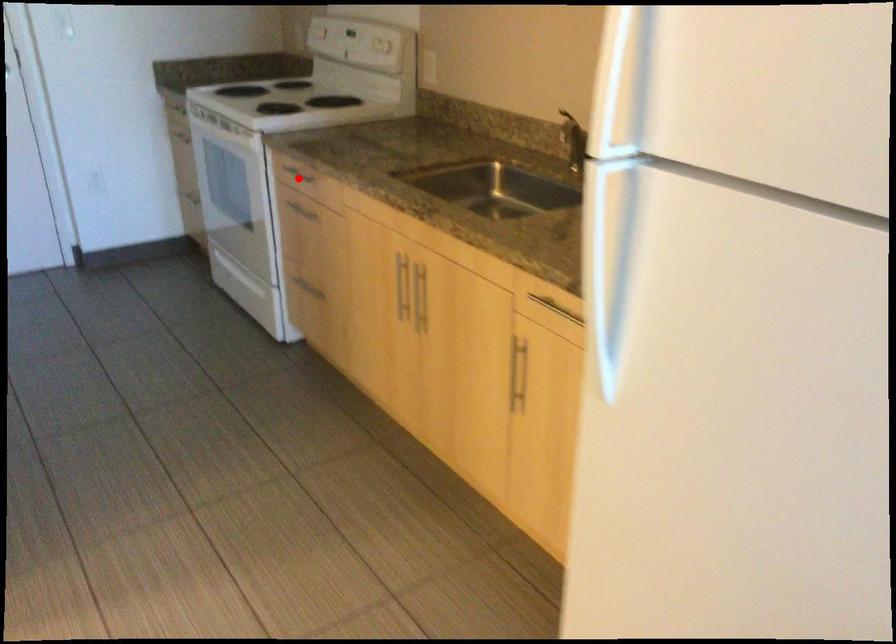
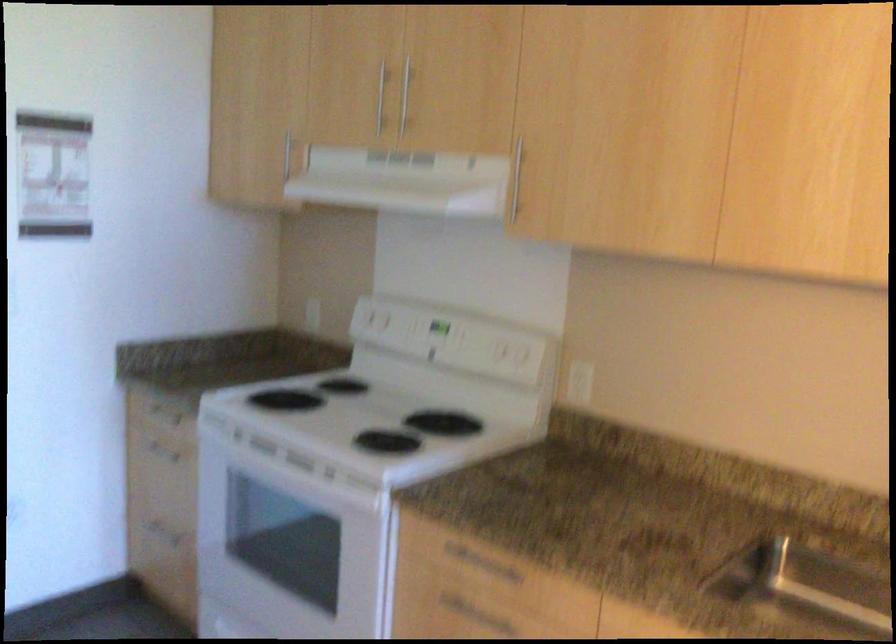
Question: A red point is marked in image1. In image2, is the corresponding 3D point closer to the camera or farther? Reply with the corresponding letter.

Choices:
 (A) The corresponding 3D point is closer.
 (B) The corresponding 3D point is farther.

Answer: (A)